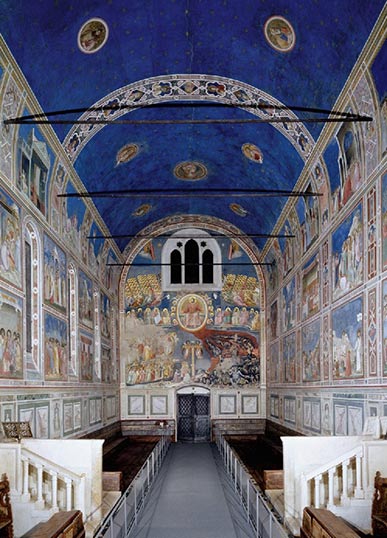
Image resolution: width=387 pixels, height=538 pixels. In order to click on right door in this screenshot , I will do `click(201, 398)`.